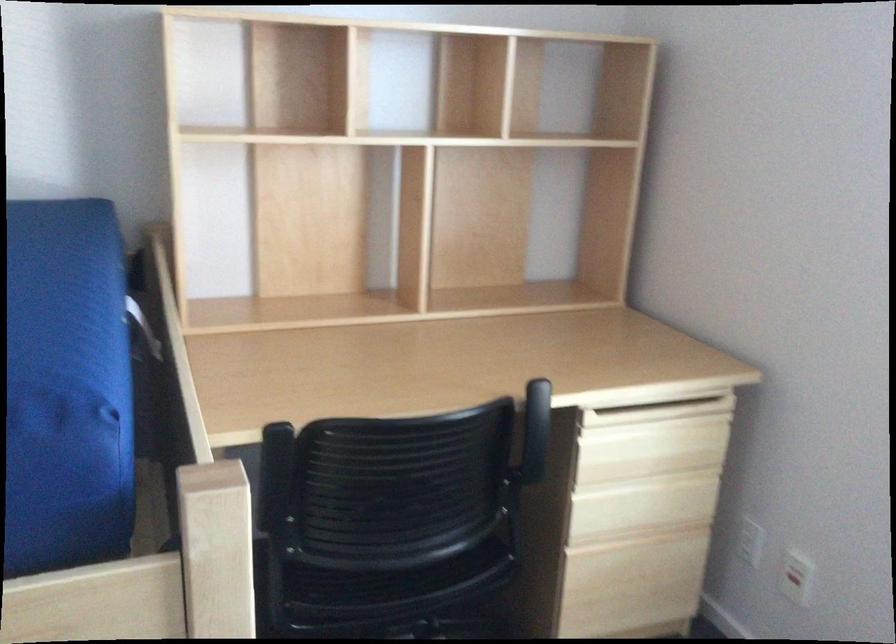
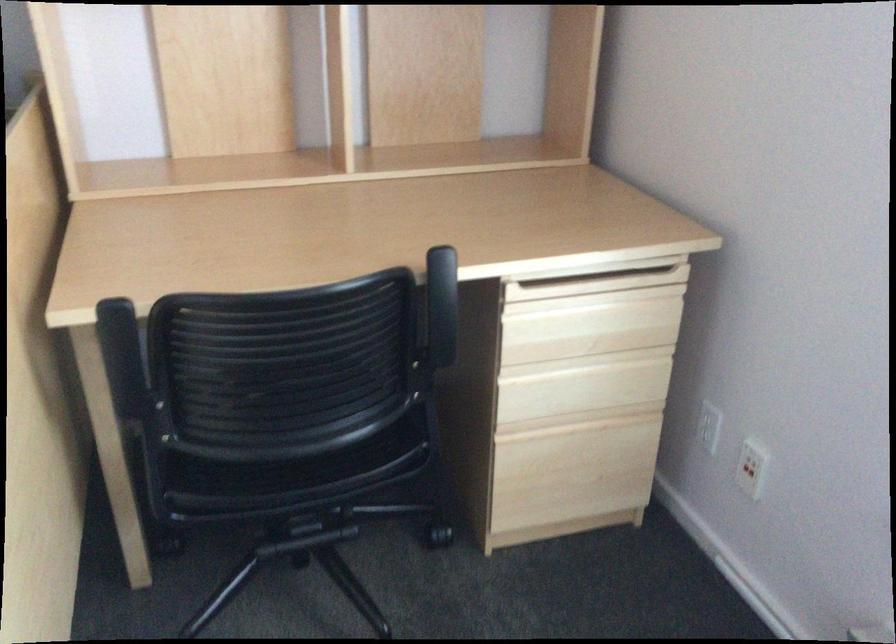
Where in the second image is the point corresponding to point 650,413 from the first image?

(587, 286)